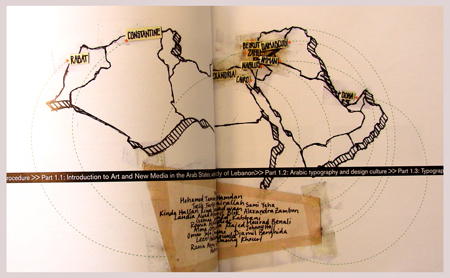
The image size is (450, 278). In order to click on brown box in this screenshot , I will do `click(157, 199)`.